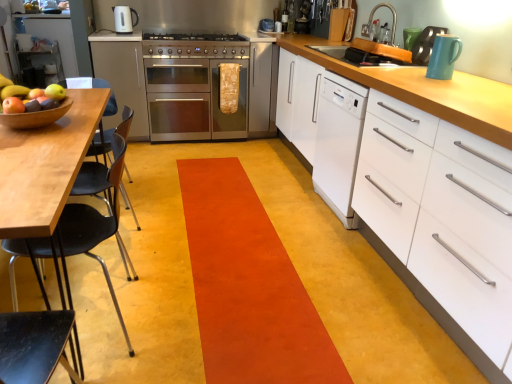
This screenshot has height=384, width=512. What are the coordinates of `orange carpet at center` in the screenshot? It's located at (248, 286).

In order to face stainless steel oven at center, should I rotate leftwards or rightwards?

To align with it, rotate left about 8.060°.

This screenshot has width=512, height=384. In order to click on black plastic chair at left in this screenshot , I will do `click(95, 216)`.

The height and width of the screenshot is (384, 512). What are the coordinates of `orange plastic sink at upper center` in the screenshot? It's located at (367, 54).

What do you see at coordinates (338, 143) in the screenshot? I see `white glossy dishwasher at center right` at bounding box center [338, 143].

Measure the distance between point (x=200, y=45) and camera.

Point (x=200, y=45) and camera are 3.62 meters apart from each other.

At what (x,y) coordinates should I click in order to perform the action: click on orange carpet at center. Please return your answer as a coordinate pair (x, y). Looking at the image, I should click on pos(248,286).

I want to click on bowl on the left of stainless steel oven at center, so click(35, 117).

Is stainless steel oven at center wider than wooden bowl at left?

Yes, stainless steel oven at center is wider than wooden bowl at left.

Does stainless steel oven at center touch wooden bowl at left?

They are not placed beside each other.

Based on the photo, is stainless steel oven at center looking in the opposite direction of wooden bowl at left?

That's not correct — stainless steel oven at center is not looking away from wooden bowl at left.

Are matte black kettle at upper center, which appears as the 2th kitchen appliance when viewed from the right, and satin silver oven at center, which is the 1th cabinetry from left to right, beside each other?

No, matte black kettle at upper center, which appears as the 2th kitchen appliance when viewed from the right, is not touching satin silver oven at center, which is the 1th cabinetry from left to right.

Which is in front, point (118, 24) or point (100, 60)?

The point (100, 60) is closer to the camera.

Is matte black kettle at upper center, which ranks as the first kitchen appliance in top-to-bottom order, positioned before satin silver oven at center, the second cabinetry when ordered from right to left?

No, the depth of matte black kettle at upper center, which ranks as the first kitchen appliance in top-to-bottom order, is greater than that of satin silver oven at center, the second cabinetry when ordered from right to left.

Between matte black kettle at upper center, which ranks as the first kitchen appliance in top-to-bottom order, and satin silver oven at center, the 2th cabinetry in the front-to-back sequence, which one has larger width?

Wider between the two is satin silver oven at center, the 2th cabinetry in the front-to-back sequence.

From a real-world perspective, which object stands above the other?

matte black kettle at upper center, positioned as the second kitchen appliance in front-to-back order.

Which is farther, (448, 43) or (115, 16)?

The point (115, 16) is more distant.

From the picture: Is matte black kettle at upper center, positioned as the second kitchen appliance in front-to-back order, surrounded by teal ceramic mug at upper right, placed as the 1th kitchen appliance when sorted from front to back?

Definitely not — matte black kettle at upper center, positioned as the second kitchen appliance in front-to-back order, is not inside teal ceramic mug at upper right, placed as the 1th kitchen appliance when sorted from front to back.

Which is more to the right, teal ceramic mug at upper right, the 2th kitchen appliance from the left, or matte black kettle at upper center, acting as the first kitchen appliance starting from the back?

Positioned to the right is teal ceramic mug at upper right, the 2th kitchen appliance from the left.

Are black plastic chair at left and matte black kettle at upper center, positioned as the second kitchen appliance in bottom-to-top order, located far from each other?

Yes.

Between black plastic chair at left and matte black kettle at upper center, which ranks as the first kitchen appliance in top-to-bottom order, which one appears on the right side from the viewer's perspective?

black plastic chair at left.

Is matte black kettle at upper center, acting as the first kitchen appliance starting from the back, inside black plastic chair at left?

No.

The width and height of the screenshot is (512, 384). Find the location of `chair in front of the orange plastic sink at upper center`. chair in front of the orange plastic sink at upper center is located at coordinates (95, 216).

Is orange plastic sink at upper center looking in the opposite direction of black plastic chair at left?

No, orange plastic sink at upper center is not facing away from black plastic chair at left.

Is orange plastic sink at upper center positioned far away from black plastic chair at left?

Yes.

Which of these two, orange plastic sink at upper center or black plastic chair at left, stands taller?

With more height is black plastic chair at left.

How many degrees apart are the facing directions of orange plastic sink at upper center and teal ceramic mug at upper right, placed as the 1th kitchen appliance when sorted from front to back?

The angle between the facing direction of orange plastic sink at upper center and the facing direction of teal ceramic mug at upper right, placed as the 1th kitchen appliance when sorted from front to back, is 0.000149 degrees.

From a real-world perspective, which object stands above the other?

teal ceramic mug at upper right, the first kitchen appliance when ordered from bottom to top, is physically above.

Are orange plastic sink at upper center and teal ceramic mug at upper right, the 1th kitchen appliance in the right-to-left sequence, far apart?

No, orange plastic sink at upper center is in close proximity to teal ceramic mug at upper right, the 1th kitchen appliance in the right-to-left sequence.

Is orange plastic sink at upper center at the left side of teal ceramic mug at upper right, the 1th kitchen appliance in the right-to-left sequence?

Yes, orange plastic sink at upper center is to the left of teal ceramic mug at upper right, the 1th kitchen appliance in the right-to-left sequence.

What's the angular difference between stainless steel oven at center and teal ceramic mug at upper right, the 2th kitchen appliance from the left,'s facing directions?

93.9 degrees separate the facing orientations of stainless steel oven at center and teal ceramic mug at upper right, the 2th kitchen appliance from the left.

Which point is more distant from viewer, (216, 135) or (442, 56)?

The point (216, 135) is farther.

From a real-world perspective, which object stands above the other?

From a 3D spatial view, teal ceramic mug at upper right, acting as the 2th kitchen appliance starting from the back, is above.

Is stainless steel oven at center thinner than teal ceramic mug at upper right, the first kitchen appliance when ordered from bottom to top?

In fact, stainless steel oven at center might be wider than teal ceramic mug at upper right, the first kitchen appliance when ordered from bottom to top.

This screenshot has width=512, height=384. Identify the location of oven located underneath the wooden bowl at left (from a real-world perspective). (192, 100).

The height and width of the screenshot is (384, 512). Find the location of `kitchen appliance behind the satin silver oven at center, the second cabinetry when ordered from right to left`. kitchen appliance behind the satin silver oven at center, the second cabinetry when ordered from right to left is located at coordinates (124, 19).

Considering their positions, is teal glossy mug at upper right, acting as the second appliance starting from the top, positioned closer to stainless steel oven at center than metallic faucet at upper right, the 1th appliance in the top-to-bottom sequence?

Based on the image, metallic faucet at upper right, the 1th appliance in the top-to-bottom sequence, appears to be nearer to stainless steel oven at center.

From the image, which object appears to be farther from teal ceramic mug at upper right, the 1th kitchen appliance in the right-to-left sequence, metallic faucet at upper right, arranged as the 1th appliance when viewed from the left, or white matte cabinet at right, the first cabinetry in the bottom-to-top sequence?

metallic faucet at upper right, arranged as the 1th appliance when viewed from the left, lies further to teal ceramic mug at upper right, the 1th kitchen appliance in the right-to-left sequence, than the other object.

From the image, which object appears to be farther from orange carpet at center, stainless steel gas stove at center or teal glossy mug at upper right, which is the second appliance in left-to-right order?

The object further to orange carpet at center is stainless steel gas stove at center.

In the scene shown: Which object lies further to the anchor point wooden bowl at left, black plastic chair at left or teal ceramic mug at upper right, placed as the 1th kitchen appliance when sorted from front to back?

Among the two, teal ceramic mug at upper right, placed as the 1th kitchen appliance when sorted from front to back, is located further to wooden bowl at left.

Which object lies nearer to the anchor point metallic faucet at upper right, the 1th appliance in the top-to-bottom sequence, orange plastic sink at upper center or wooden bowl at left?

orange plastic sink at upper center is closer to metallic faucet at upper right, the 1th appliance in the top-to-bottom sequence.

Estimate the real-world distances between objects in this image. Which object is closer to matte brown apple at left, wooden bowl at left or stainless steel gas stove at center?

Among the two, wooden bowl at left is located nearer to matte brown apple at left.

Looking at the image, which one is located closer to orange carpet at center, teal glossy mug at upper right, which is the second appliance in left-to-right order, or stainless steel gas stove at center?

Among the two, teal glossy mug at upper right, which is the second appliance in left-to-right order, is located nearer to orange carpet at center.

Estimate the real-world distances between objects in this image. Which object is closer to satin silver oven at center, the 2th cabinetry in the front-to-back sequence, teal ceramic mug at upper right, which ranks as the 2th kitchen appliance in top-to-bottom order, or black plastic chair at left?

black plastic chair at left is closer to satin silver oven at center, the 2th cabinetry in the front-to-back sequence.

This screenshot has width=512, height=384. Find the location of `sink positioned between orange carpet at center and stainless steel gas stove at center from near to far`. sink positioned between orange carpet at center and stainless steel gas stove at center from near to far is located at coordinates (367, 54).

At what (x,y) coordinates should I click in order to perform the action: click on strip between white matte cabinet at right, which appears as the second cabinetry when viewed from the top, and matte black kettle at upper center, which appears as the 2th kitchen appliance when viewed from the right, from front to back. Please return your answer as a coordinate pair (x, y). This screenshot has width=512, height=384. Looking at the image, I should click on (248, 286).

This screenshot has width=512, height=384. In order to click on home appliance situated between stainless steel oven at center and metallic faucet at upper right, which appears as the second appliance when ordered from the bottom, from left to right in this screenshot , I will do `click(338, 143)`.

Where is `kitchen appliance located between orange carpet at center and teal glossy mug at upper right, which is the second appliance in left-to-right order, in the left-right direction`? The width and height of the screenshot is (512, 384). kitchen appliance located between orange carpet at center and teal glossy mug at upper right, which is the second appliance in left-to-right order, in the left-right direction is located at coordinates (444, 56).